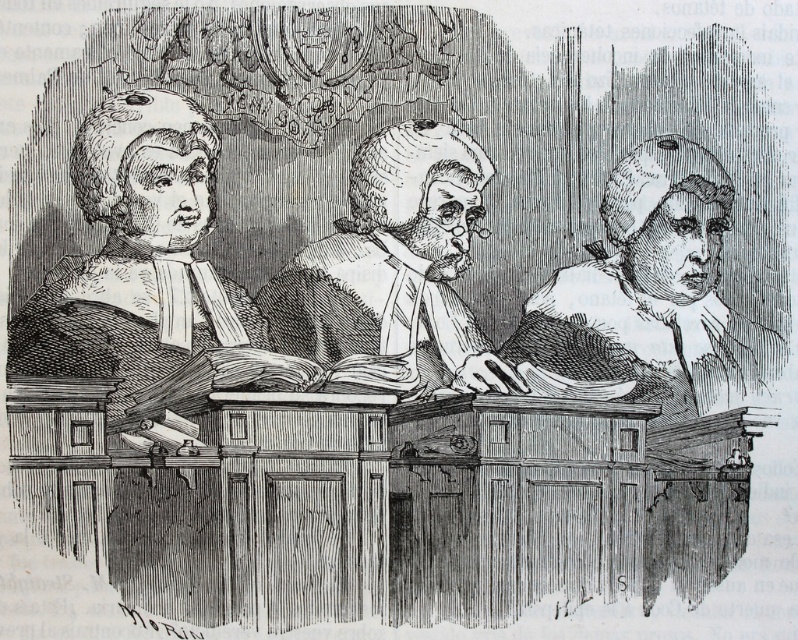
In the scene shown: In the courtroom scene, there are three individuals seated on a wooden bench. The first person on the left has a short rounded wig, the second person at center has a smooth gray wig, and the third person on the right also has a wig. If you were to draw a straight line from the bottom of the bench to the top of the courtroom wall, would the smooth gray wig at center be above or below this line?

The smooth gray wig at center is located at 2D coordinates point (648, 296). Since the line drawn from the bottom of the bench to the top of the courtroom wall would likely pass through the midpoint of the image vertically, the wig is positioned above this line because its y coordinate 0.813 is higher than the midpoint 0.5.

In the courtroom scene, you are an assistant asked to identify the largest object among the matte black wig at center and the smooth parchment document at center. Which one is larger?

The matte black wig at center is bigger than the smooth parchment document at center, so the matte black wig at center is the larger object.